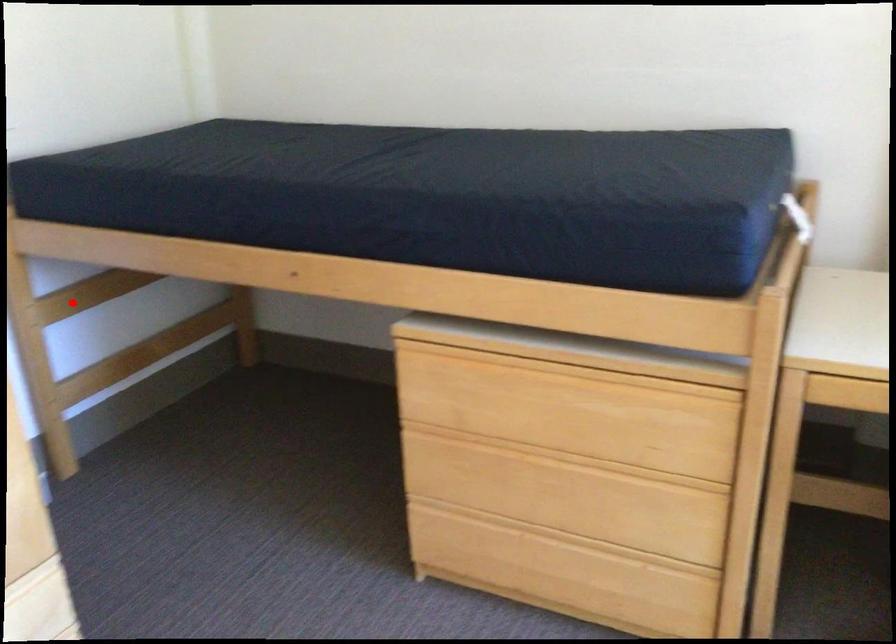
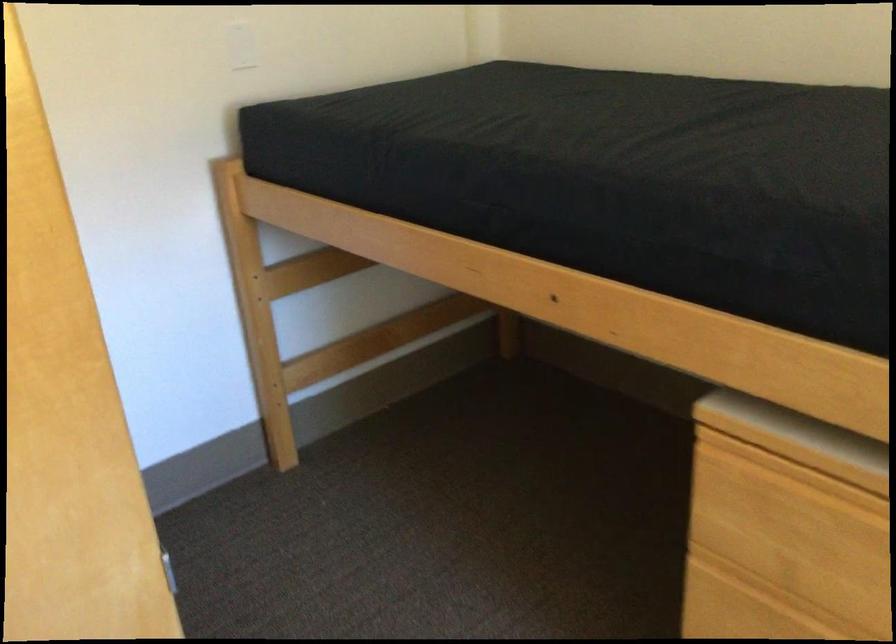
Question: I am providing you with two images of the same scene from different viewpoints. Given a red point in image1, look at the same physical point in image2. Is it:

Choices:
 (A) Closer to the viewpoint
 (B) Farther from the viewpoint

Answer: (A)